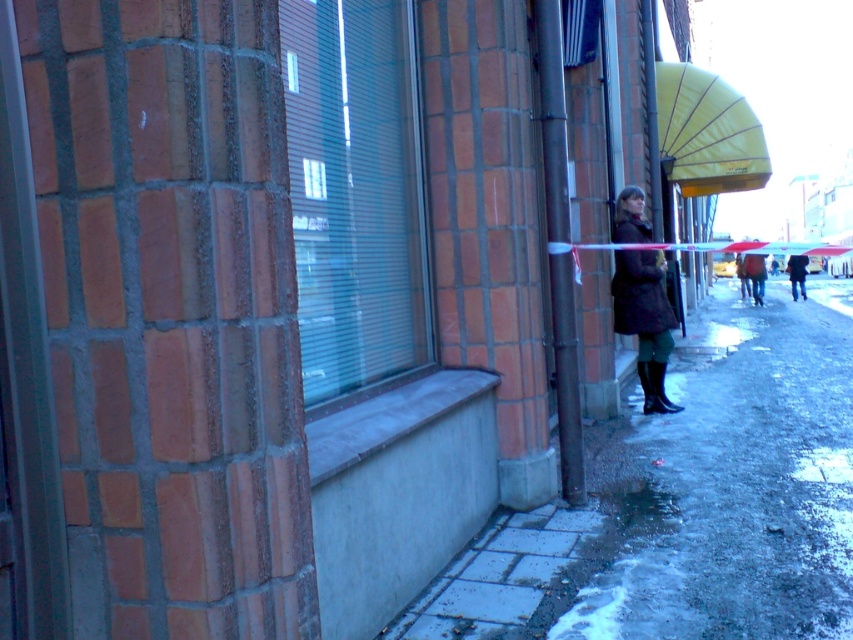
You are a delivery person trying to reach a package left on the smooth concrete sidewalk at lower right. You are currently standing next to the dark brown leather jacket at center. Is the sidewalk accessible from your current position?

The smooth concrete sidewalk at lower right is located below the dark brown leather jacket at center, so yes, the sidewalk is accessible from your current position.

You are standing on the sidewalk and see two points marked on the ground. The first point is at coordinates point (335, 317) and the second is at point (657, 397). Which point is closer to your current position?

Point (335, 317) is closer to the camera than point (657, 397), so it is closer to your current position.

You are a delivery person trying to reach the entrance of the brick building. The entrance is located at point 0.5, 0.9. You see the dark brown leather jacket at center. Is the jacket blocking your path to the entrance?

The dark brown leather jacket at center is located at point (755,275), which is slightly to the left and below the entrance at (767,320). Therefore, the jacket is not directly blocking the path to the entrance.